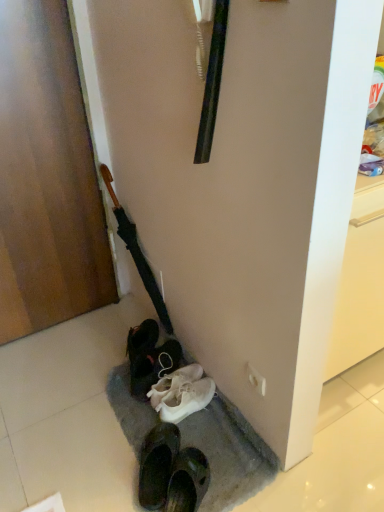
Question: Does black matte umbrella at left appear on the right side of wooden door at left?

Choices:
 (A) yes
 (B) no

Answer: (A)

Question: Can you confirm if black matte umbrella at left is smaller than wooden door at left?

Choices:
 (A) yes
 (B) no

Answer: (A)

Question: Is black matte umbrella at left facing away from wooden door at left?

Choices:
 (A) yes
 (B) no

Answer: (B)

Question: Is wooden door at left inside black matte umbrella at left?

Choices:
 (A) yes
 (B) no

Answer: (B)

Question: Would you consider black matte umbrella at left to be distant from wooden door at left?

Choices:
 (A) yes
 (B) no

Answer: (B)

Question: Is white matte sneakers at lower center bigger or smaller than wooden door at left?

Choices:
 (A) small
 (B) big

Answer: (A)

Question: Would you say white matte sneakers at lower center is to the left or to the right of wooden door at left in the picture?

Choices:
 (A) right
 (B) left

Answer: (A)

Question: Does point (150, 386) appear closer or farther from the camera than point (84, 185)?

Choices:
 (A) closer
 (B) farther

Answer: (A)

Question: From the image's perspective, is white matte sneakers at lower center above or below wooden door at left?

Choices:
 (A) below
 (B) above

Answer: (A)

Question: Choose the correct answer: Is white matte sneakers at lower center inside black matte umbrella at left or outside it?

Choices:
 (A) outside
 (B) inside

Answer: (A)

Question: From the image's perspective, relative to black matte umbrella at left, is white matte sneakers at lower center above or below?

Choices:
 (A) above
 (B) below

Answer: (B)

Question: Looking at their shapes, would you say white matte sneakers at lower center is wider or thinner than black matte umbrella at left?

Choices:
 (A) wide
 (B) thin

Answer: (A)

Question: Is white matte sneakers at lower center in front of or behind black matte umbrella at left in the image?

Choices:
 (A) behind
 (B) front

Answer: (A)

Question: Relative to black matte umbrella at left, is wooden door at left in front or behind?

Choices:
 (A) behind
 (B) front

Answer: (B)

Question: Based on their positions, is wooden door at left located to the left or right of black matte umbrella at left?

Choices:
 (A) left
 (B) right

Answer: (A)